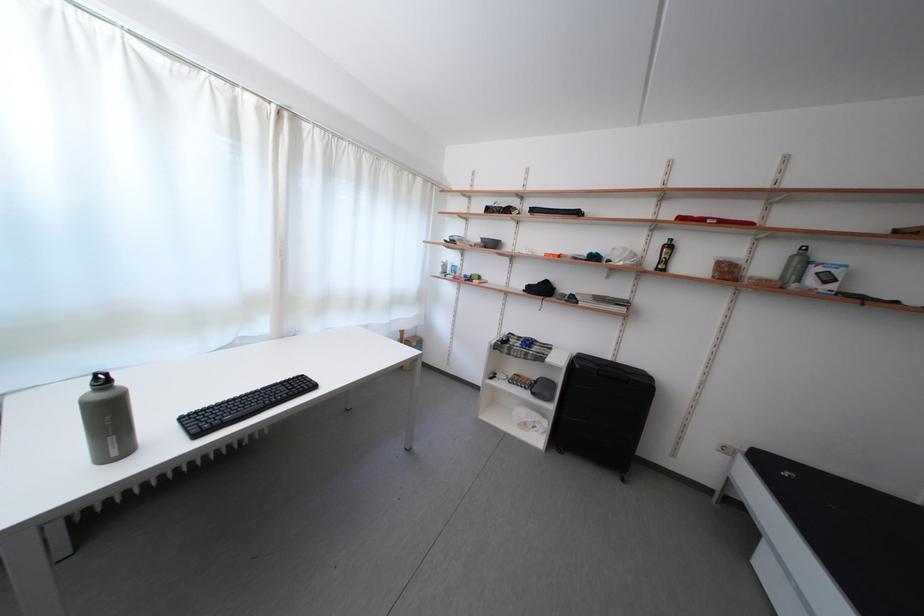
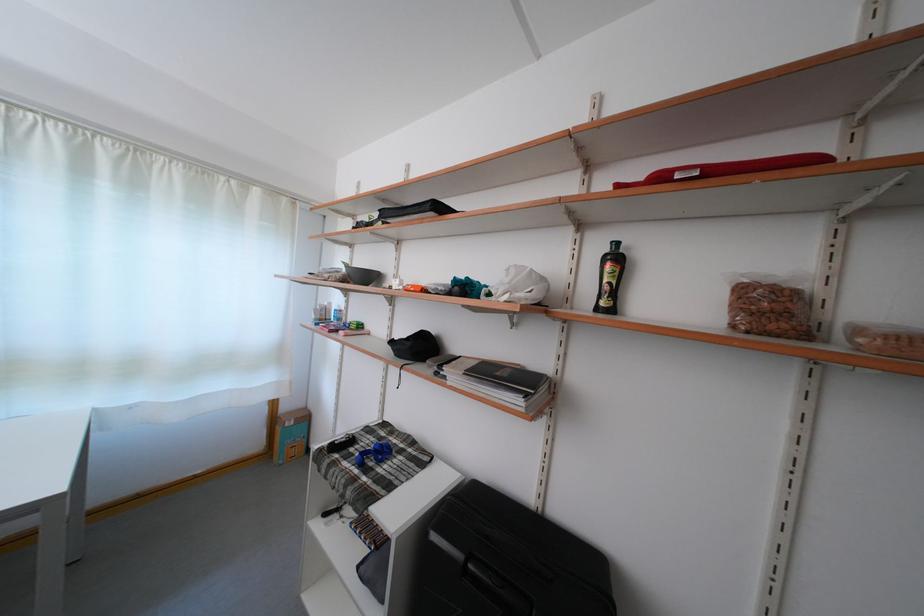
Where in the second image is the point corresponding to point (416, 341) from the first image?

(293, 415)